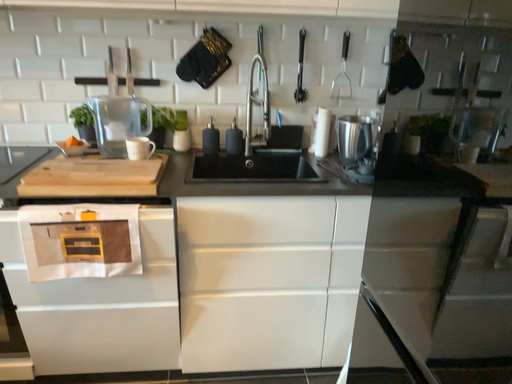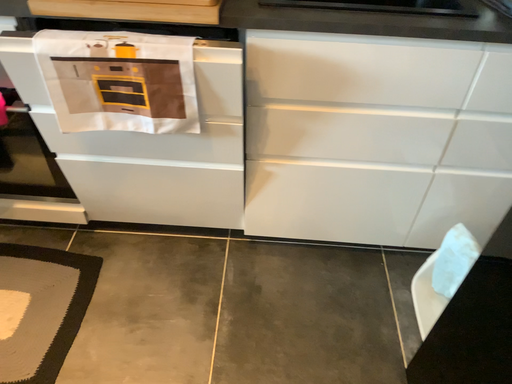
Question: Which way did the camera rotate in the video?

Choices:
 (A) rotated left
 (B) rotated right

Answer: (A)